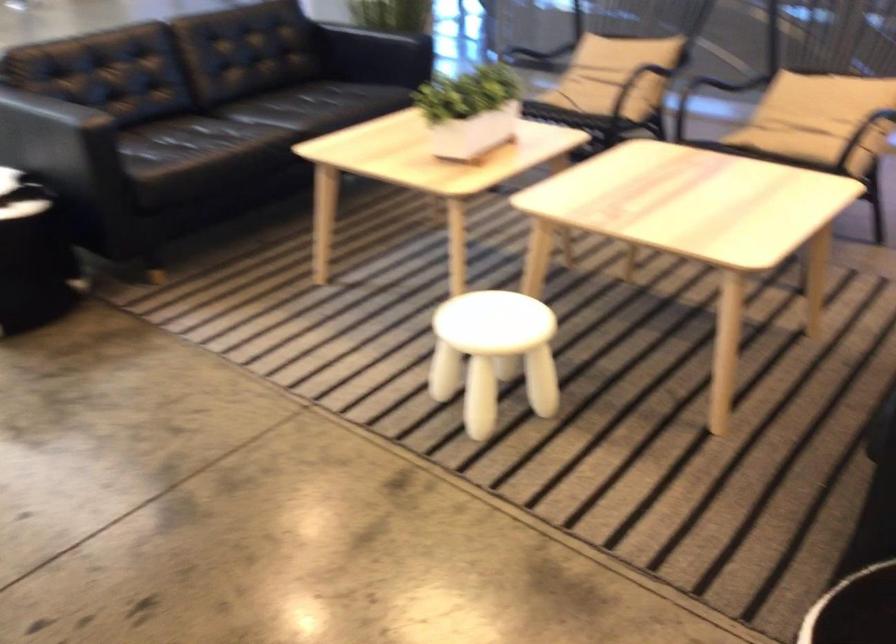
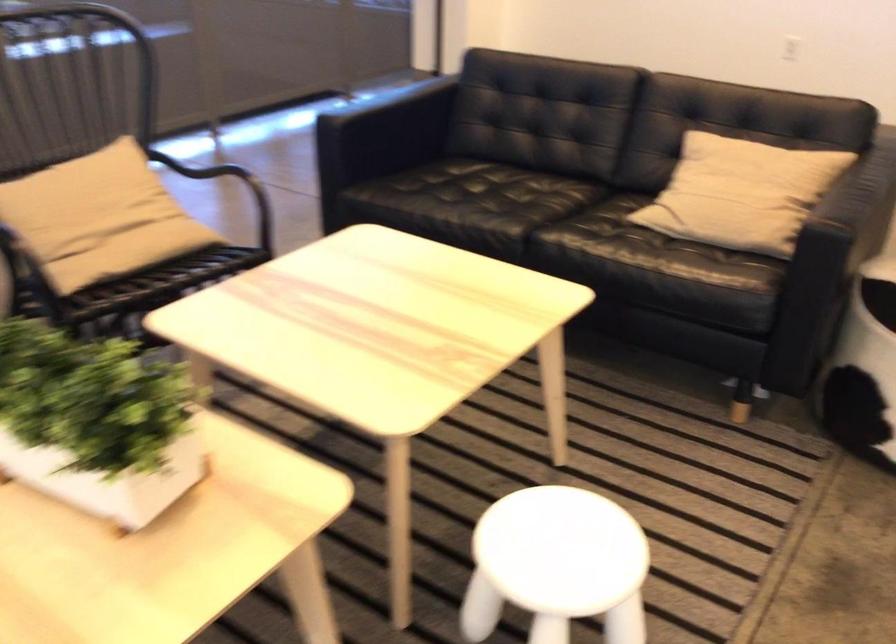
Where in the second image is the point corresponding to (x=788, y=136) from the first image?

(151, 254)